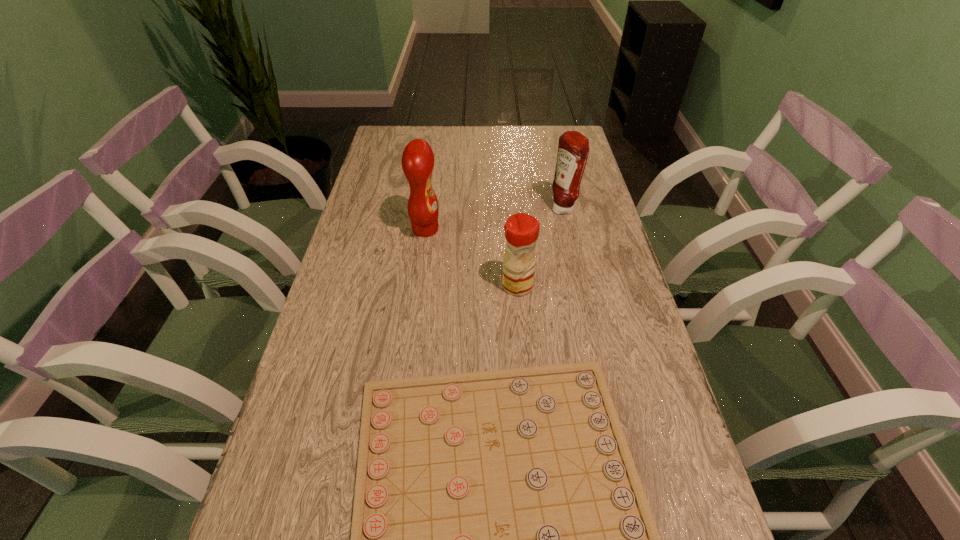
Image resolution: width=960 pixels, height=540 pixels. I want to click on vacant space at the right edge, so click(x=601, y=227).

Where is `vacant area at the far left corner`? Image resolution: width=960 pixels, height=540 pixels. vacant area at the far left corner is located at coordinates click(396, 131).

This screenshot has height=540, width=960. I want to click on vacant space at the far right corner of the desktop, so click(545, 147).

Identify the location of free space between the leftmost condiment and the rightmost condiment. The height and width of the screenshot is (540, 960). (494, 219).

The width and height of the screenshot is (960, 540). In order to click on free space between the leftmost condiment and the nearest condiment in this screenshot , I will do `click(471, 258)`.

Identify which object is the nearest to the nearest object. Please provide its 2D coordinates. Your answer should be formatted as a tuple, i.e. [(x, y)], where the tuple contains the x and y coordinates of a point satisfying the conditions above.

[(521, 230)]

Where is `the closest object to the shortest object`? The image size is (960, 540). the closest object to the shortest object is located at coordinates (521, 230).

Locate which condiment is the second closest to the rightmost condiment. Please provide its 2D coordinates. Your answer should be formatted as a tuple, i.e. [(x, y)], where the tuple contains the x and y coordinates of a point satisfying the conditions above.

[(417, 160)]

The image size is (960, 540). Find the location of `condiment that can be found as the closest to the second condiment from left to right`. condiment that can be found as the closest to the second condiment from left to right is located at coordinates (417, 160).

In order to click on vacant position in the image that satisfies the following two spatial constraints: 1. on the front side of the rightmost condiment; 2. on the label side of the leftmost condiment in this screenshot , I will do `click(567, 230)`.